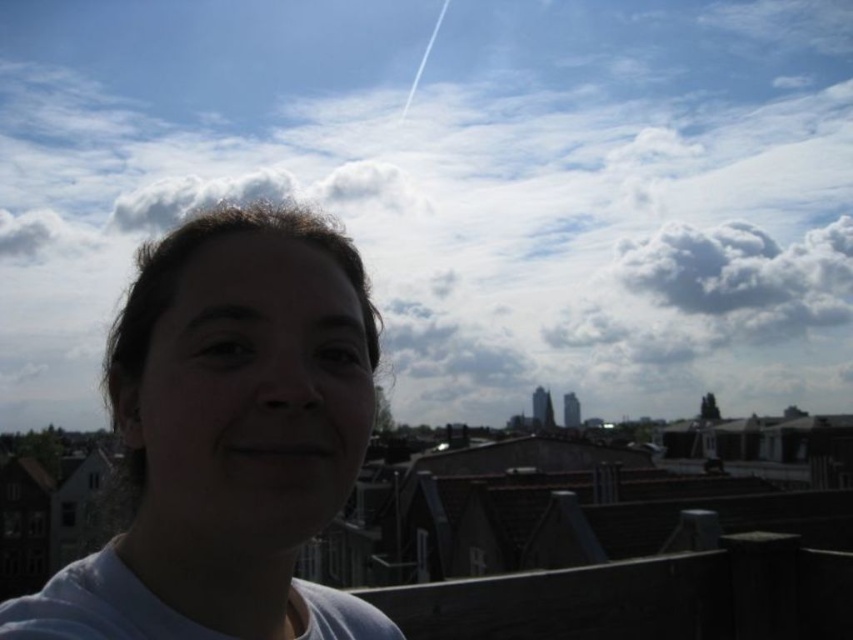
Between white fluffy cloud at upper center and white matte face at center, which one has less height?

With less height is white matte face at center.

Is white fluffy cloud at upper center in front of white matte face at center?

No, it is behind white matte face at center.

This screenshot has height=640, width=853. Identify the location of white fluffy cloud at upper center. (454, 188).

Locate an element on the screen. The height and width of the screenshot is (640, 853). white fluffy cloud at upper center is located at coordinates (454, 188).